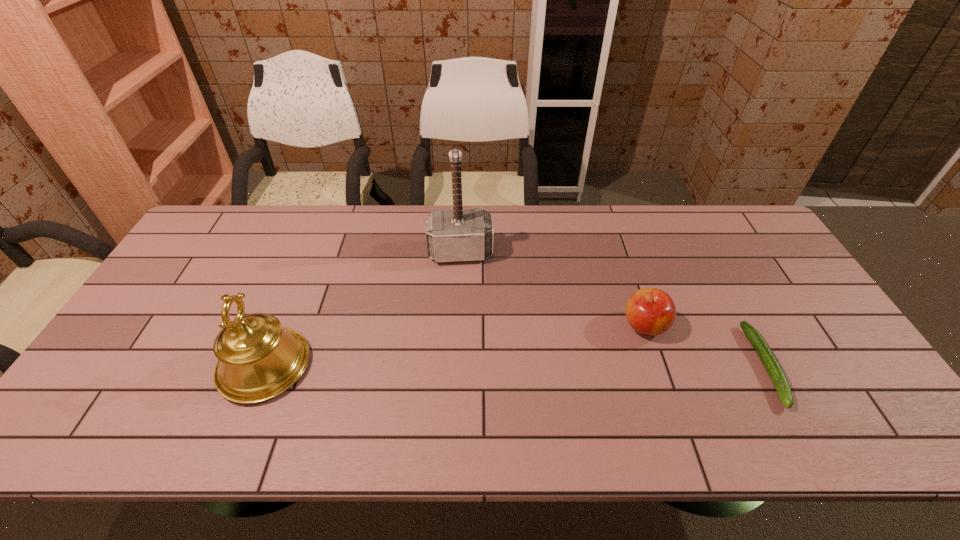
You are a GUI agent. You are given a task and a screenshot of the screen. Output one action in this format:
    pyautogui.click(x=<x>, y=<y>)
    Task: Click on the third shortest object
    Image resolution: width=960 pixels, height=540 pixels.
    Given the screenshot: What is the action you would take?
    pyautogui.click(x=258, y=359)

This screenshot has width=960, height=540. I want to click on bell, so pyautogui.click(x=258, y=359).

In order to click on zucchini in this screenshot , I will do `click(766, 355)`.

I want to click on the rightmost object, so click(x=766, y=355).

What are the coordinates of `apple` in the screenshot? It's located at click(650, 311).

Where is `the third object from left to right`? Image resolution: width=960 pixels, height=540 pixels. the third object from left to right is located at coordinates (650, 311).

What are the coordinates of `hammer` in the screenshot? It's located at (460, 234).

Identify the location of the second object from left to right. (460, 234).

Where is `vacant point located on the right of the bell`? This screenshot has width=960, height=540. vacant point located on the right of the bell is located at coordinates (361, 366).

Where is `vacant region located 0.140m on the stem of the apple`? vacant region located 0.140m on the stem of the apple is located at coordinates (591, 362).